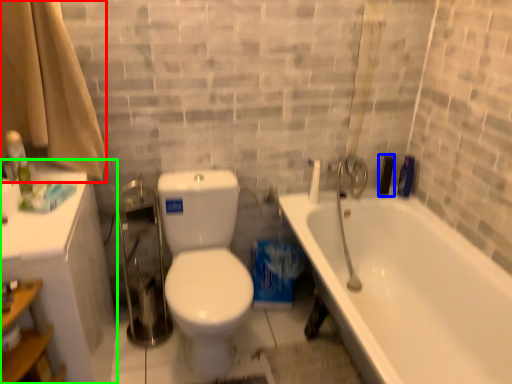
Question: Which object is the closest to the shower curtain (highlighted by a red box)? Choose among these: toiletry (highlighted by a blue box) or medicine cabinet (highlighted by a green box).

Choices:
 (A) toiletry
 (B) medicine cabinet

Answer: (B)